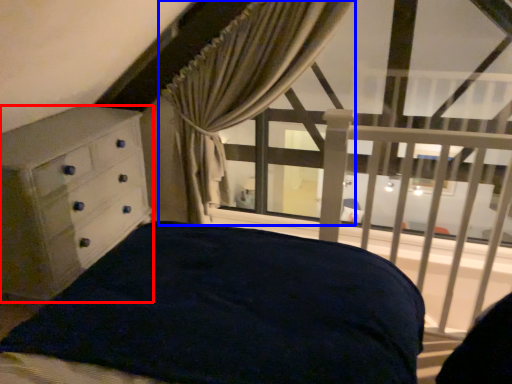
Question: Among these objects, which one is farthest to the camera, chest of drawers (highlighted by a red box) or curtain (highlighted by a blue box)?

Choices:
 (A) chest of drawers
 (B) curtain

Answer: (B)